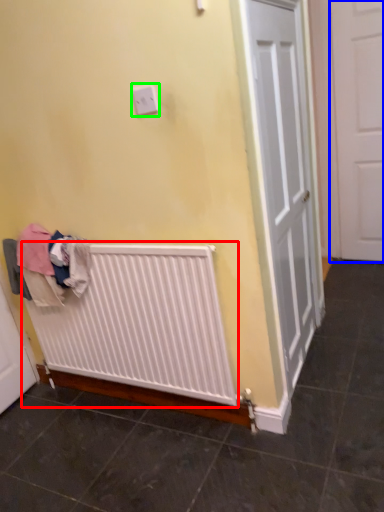
Question: Based on their relative distances, which object is farther from radiator (highlighted by a red box)? Choose from door (highlighted by a blue box) and electric outlet (highlighted by a green box).

Choices:
 (A) door
 (B) electric outlet

Answer: (A)